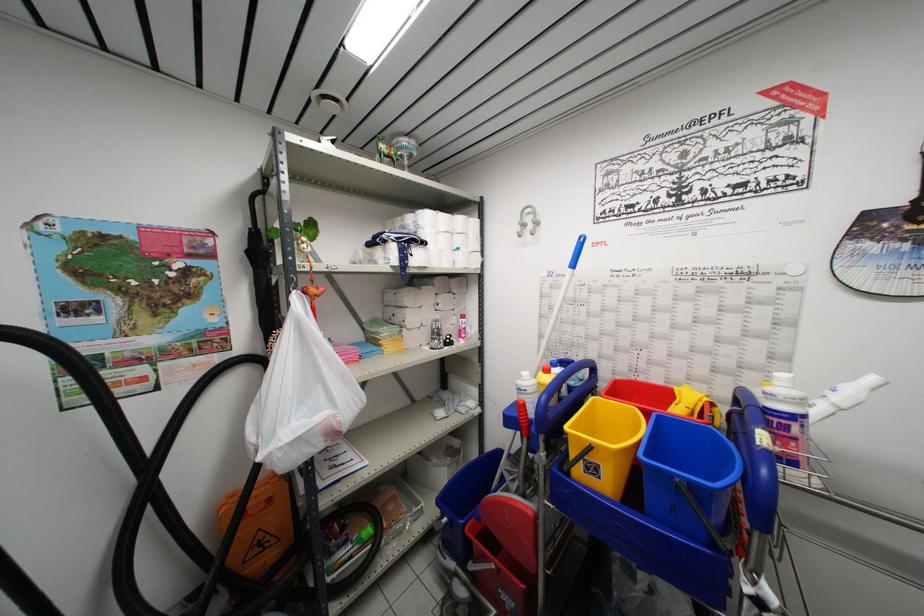
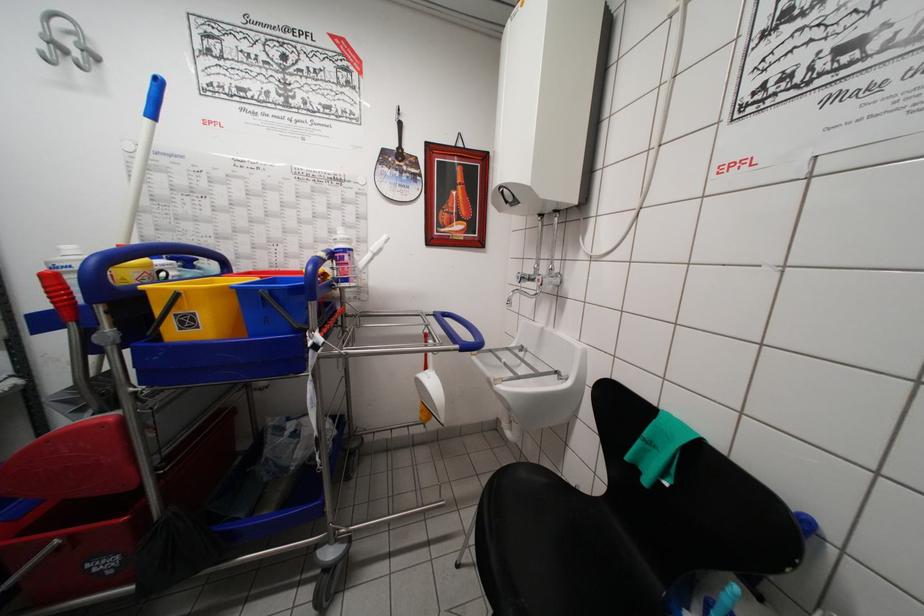
Find the pixel in the second image that matches pixel 843 403 in the first image.

(377, 253)